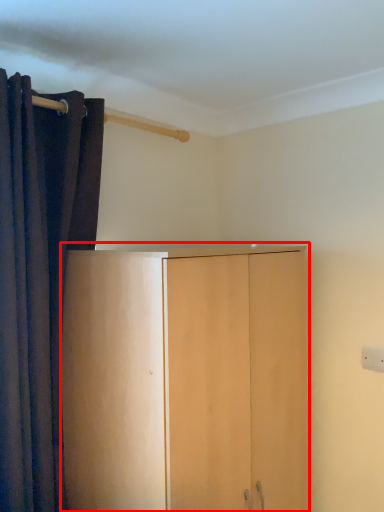
Question: From the image's perspective, what is the correct spatial relationship of cupboard (annotated by the red box) in relation to curtain?

Choices:
 (A) above
 (B) below

Answer: (B)